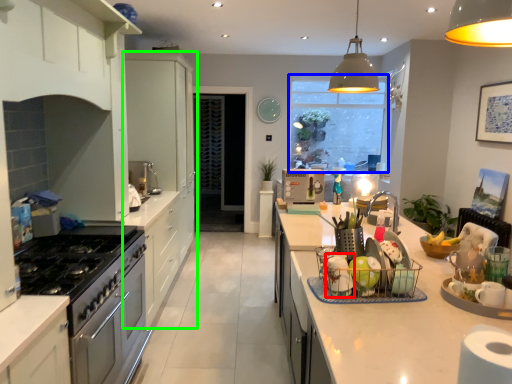
Question: Based on their relative distances, which object is farther from appliance (highlighted by a red box)? Choose from window screen (highlighted by a blue box) and cabinetry (highlighted by a green box).

Choices:
 (A) window screen
 (B) cabinetry

Answer: (A)